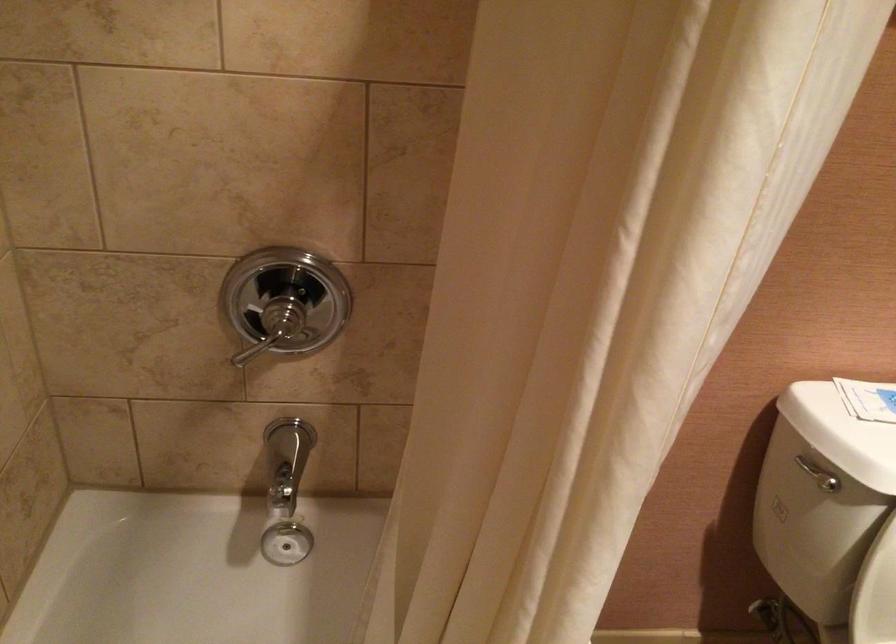
The height and width of the screenshot is (644, 896). Describe the element at coordinates (287, 460) in the screenshot. I see `the faucet diverter knob` at that location.